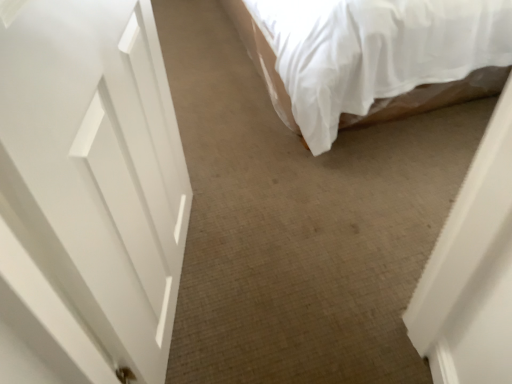
Question: Is white fabric bed at upper right taller than white glossy door at left?

Choices:
 (A) yes
 (B) no

Answer: (B)

Question: Is white fabric bed at upper right to the left of white glossy door at left from the viewer's perspective?

Choices:
 (A) yes
 (B) no

Answer: (B)

Question: Is white fabric bed at upper right facing towards white glossy door at left?

Choices:
 (A) no
 (B) yes

Answer: (A)

Question: Would you say white glossy door at left is part of white fabric bed at upper right's contents?

Choices:
 (A) yes
 (B) no

Answer: (B)

Question: Considering the relative positions of white fabric bed at upper right and white glossy door at left in the image provided, is white fabric bed at upper right in front of white glossy door at left?

Choices:
 (A) yes
 (B) no

Answer: (B)

Question: Is the position of white fabric bed at upper right more distant than that of white glossy door at left?

Choices:
 (A) no
 (B) yes

Answer: (B)

Question: From a real-world perspective, is white glossy door at left below white fabric bed at upper right?

Choices:
 (A) yes
 (B) no

Answer: (B)

Question: Considering the relative sizes of white glossy door at left and white fabric bed at upper right in the image provided, is white glossy door at left shorter than white fabric bed at upper right?

Choices:
 (A) yes
 (B) no

Answer: (B)

Question: Can you confirm if white glossy door at left is smaller than white fabric bed at upper right?

Choices:
 (A) no
 (B) yes

Answer: (B)

Question: Is white glossy door at left next to white fabric bed at upper right and touching it?

Choices:
 (A) no
 (B) yes

Answer: (A)

Question: From the image's perspective, is white glossy door at left beneath white fabric bed at upper right?

Choices:
 (A) yes
 (B) no

Answer: (A)

Question: Is white fabric bed at upper right surrounded by white glossy door at left?

Choices:
 (A) yes
 (B) no

Answer: (B)

Question: From the image's perspective, is white glossy door at left above or below white fabric bed at upper right?

Choices:
 (A) below
 (B) above

Answer: (A)